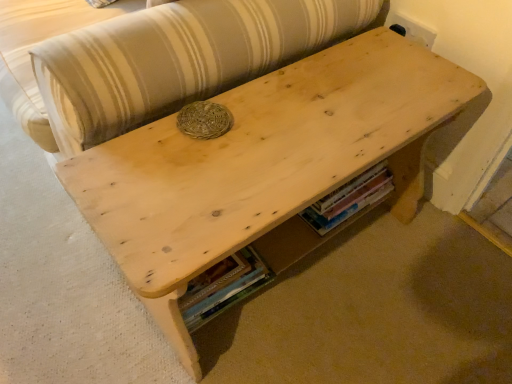
Question: Does wooden book at lower center, arranged as the second book when viewed from the left, have a lesser height compared to natural wood couch at upper center?

Choices:
 (A) no
 (B) yes

Answer: (B)

Question: Is wooden book at lower center, the first book when ordered from top to bottom, thinner than natural wood couch at upper center?

Choices:
 (A) no
 (B) yes

Answer: (B)

Question: Is wooden book at lower center, arranged as the second book when viewed from the left, in contact with natural wood couch at upper center?

Choices:
 (A) yes
 (B) no

Answer: (B)

Question: Is wooden book at lower center, which is counted as the first book, starting from the right, at the left side of natural wood couch at upper center?

Choices:
 (A) no
 (B) yes

Answer: (A)

Question: Could you tell me if wooden book at lower center, arranged as the second book when viewed from the left, is turned towards natural wood couch at upper center?

Choices:
 (A) yes
 (B) no

Answer: (B)

Question: In the image, is wooden book at lower center, arranged as the 2th book when viewed from the top, positioned in front of or behind wooden book at lower center, which is counted as the first book, starting from the right?

Choices:
 (A) front
 (B) behind

Answer: (A)

Question: Is wooden book at lower center, which appears as the 1th book when ordered from the bottom, wider or thinner than wooden book at lower center, the first book when ordered from top to bottom?

Choices:
 (A) thin
 (B) wide

Answer: (B)

Question: From a real-world perspective, is wooden book at lower center, the 1th book when ordered from left to right, physically located above or below wooden book at lower center, the first book when ordered from top to bottom?

Choices:
 (A) below
 (B) above

Answer: (A)

Question: Is wooden book at lower center, the second book from the right, inside or outside of wooden book at lower center, arranged as the second book when viewed from the left?

Choices:
 (A) inside
 (B) outside

Answer: (B)

Question: Which is correct: wooden book at lower center, the 1th book when ordered from left to right, is inside natural wood couch at upper center, or outside of it?

Choices:
 (A) inside
 (B) outside

Answer: (B)

Question: In the image, is wooden book at lower center, the 1th book when ordered from left to right, on the left side or the right side of natural wood couch at upper center?

Choices:
 (A) left
 (B) right

Answer: (B)

Question: From a real-world perspective, is wooden book at lower center, arranged as the 2th book when viewed from the top, physically located above or below natural wood couch at upper center?

Choices:
 (A) below
 (B) above

Answer: (A)

Question: Is point (x=194, y=291) positioned closer to the camera than point (x=286, y=51)?

Choices:
 (A) farther
 (B) closer

Answer: (B)

Question: Relative to wooden book at lower center, arranged as the 2th book when viewed from the top, is wooden book at lower center, the second book in the bottom-to-top sequence, in front or behind?

Choices:
 (A) front
 (B) behind

Answer: (B)

Question: From a real-world perspective, is wooden book at lower center, which is counted as the first book, starting from the right, above or below wooden book at lower center, the second book from the right?

Choices:
 (A) above
 (B) below

Answer: (A)